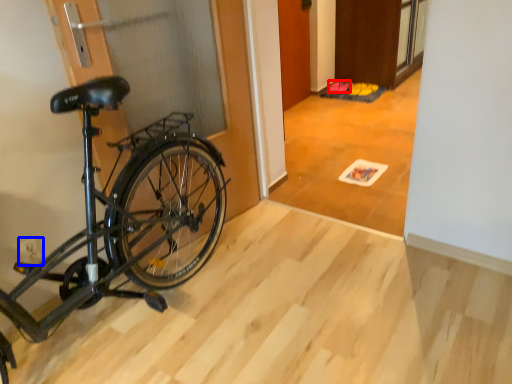
Question: Which object appears farthest to the camera in this image, walking shoe (highlighted by a red box) or power plugs and sockets (highlighted by a blue box)?

Choices:
 (A) walking shoe
 (B) power plugs and sockets

Answer: (A)